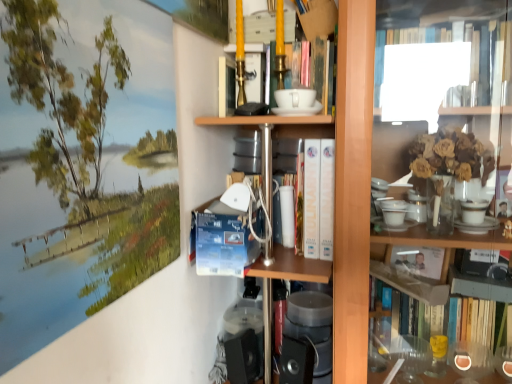
Question: Is there a large distance between wooden bookcase at center and white paperback books at center?

Choices:
 (A) no
 (B) yes

Answer: (A)

Question: Could you tell me if wooden bookcase at center is turned towards white paperback books at center?

Choices:
 (A) no
 (B) yes

Answer: (B)

Question: Can you confirm if wooden bookcase at center is taller than white paperback books at center?

Choices:
 (A) no
 (B) yes

Answer: (B)

Question: Would you say wooden bookcase at center contains white paperback books at center?

Choices:
 (A) yes
 (B) no

Answer: (A)

Question: From the image's perspective, does wooden bookcase at center appear higher than white paperback books at center?

Choices:
 (A) yes
 (B) no

Answer: (B)

Question: From the image's perspective, does wooden bookcase at center appear lower than white paperback books at center?

Choices:
 (A) no
 (B) yes

Answer: (B)

Question: From the image's perspective, would you say white paperback books at center is positioned over wooden bookcase at center?

Choices:
 (A) no
 (B) yes

Answer: (B)

Question: Can you confirm if white paperback books at center is thinner than wooden bookcase at center?

Choices:
 (A) yes
 (B) no

Answer: (A)

Question: Could wooden bookcase at center be considered to be inside white paperback books at center?

Choices:
 (A) yes
 (B) no

Answer: (B)

Question: Considering the relative sizes of white paperback books at center and wooden bookcase at center in the image provided, is white paperback books at center wider than wooden bookcase at center?

Choices:
 (A) yes
 (B) no

Answer: (B)

Question: Is white paperback books at center taller than wooden bookcase at center?

Choices:
 (A) no
 (B) yes

Answer: (A)

Question: Is white paperback books at center turned away from wooden bookcase at center?

Choices:
 (A) yes
 (B) no

Answer: (A)

Question: Choose the correct answer: Is wooden bookcase at center inside white paperback books at center or outside it?

Choices:
 (A) outside
 (B) inside

Answer: (A)